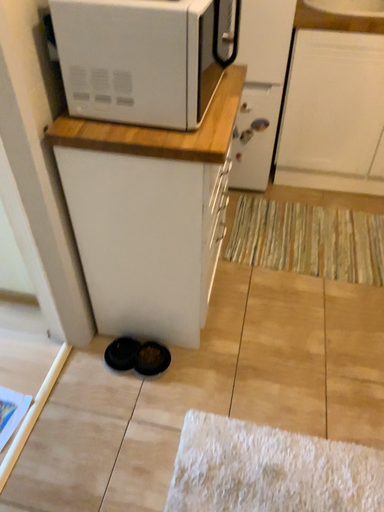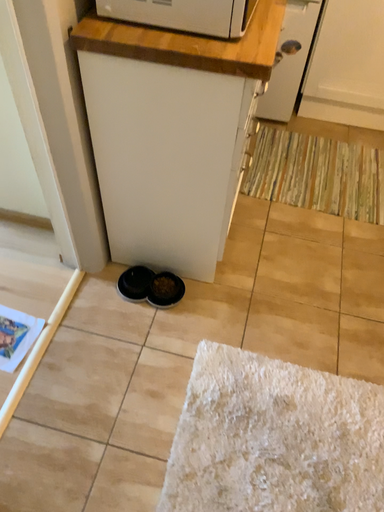
Question: How did the camera likely rotate when shooting the video?

Choices:
 (A) rotated downward
 (B) rotated upward

Answer: (A)